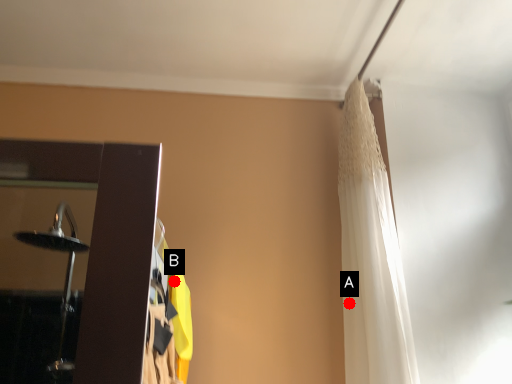
Question: Two points are circled on the image, labeled by A and B beside each circle. Which point is closer to the camera?

Choices:
 (A) A is closer
 (B) B is closer

Answer: (B)